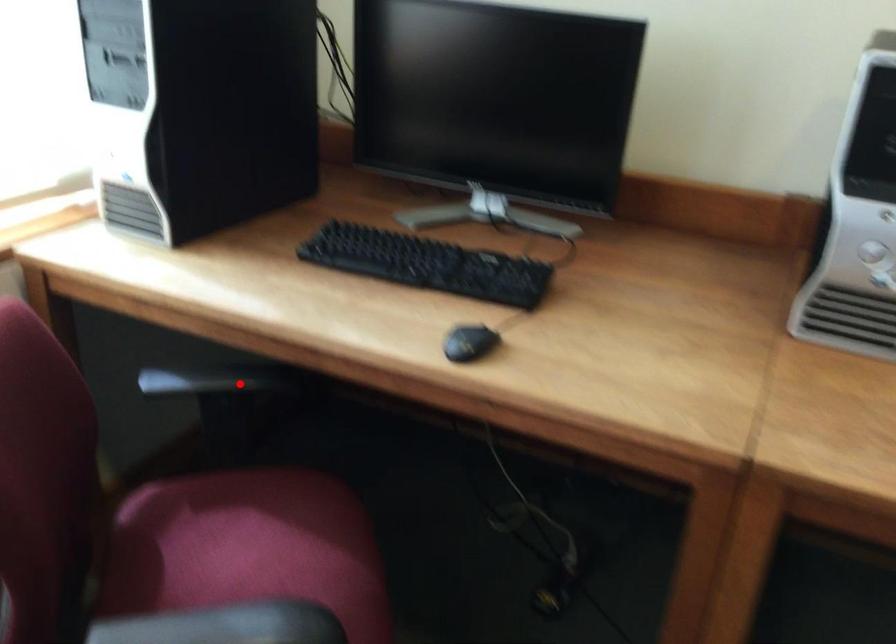
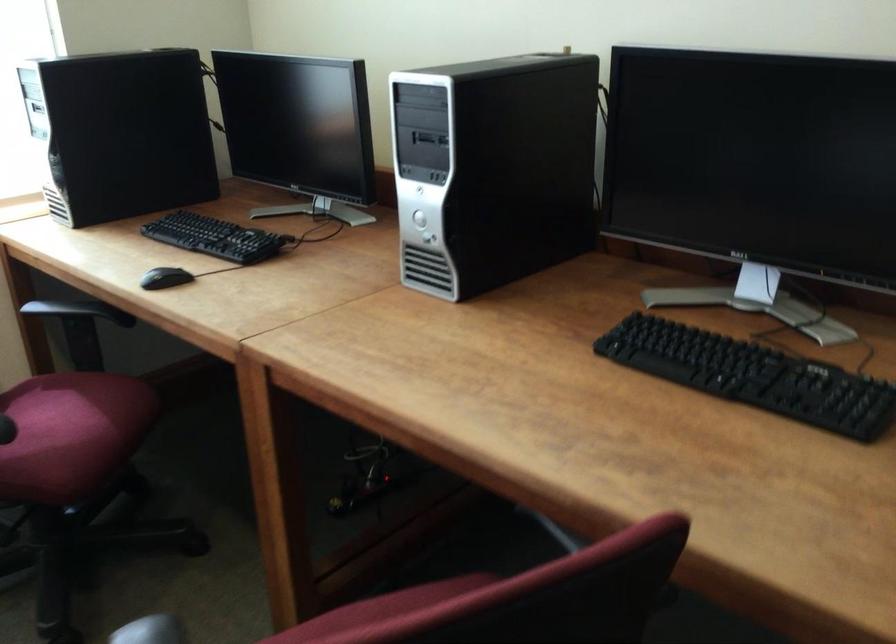
The point at the highlighted location is marked in the first image. Where is the corresponding point in the second image?

(74, 310)